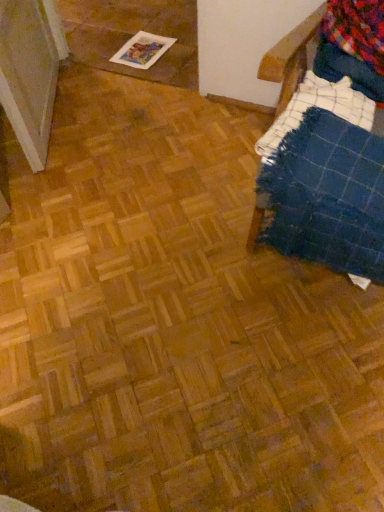
Locate an element on the screen. The width and height of the screenshot is (384, 512). vacant region to the right of printed paper magazine at upper left is located at coordinates (183, 48).